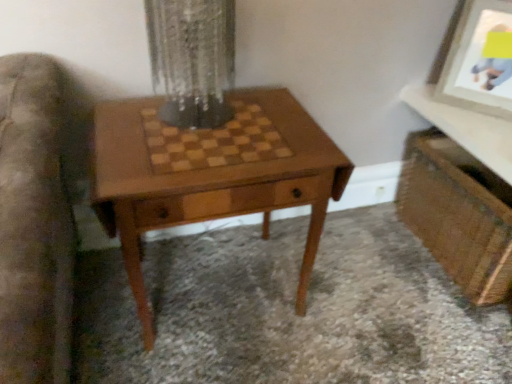
Locate an element on the screen. The height and width of the screenshot is (384, 512). free spot to the right of wooden chess table at center is located at coordinates (361, 302).